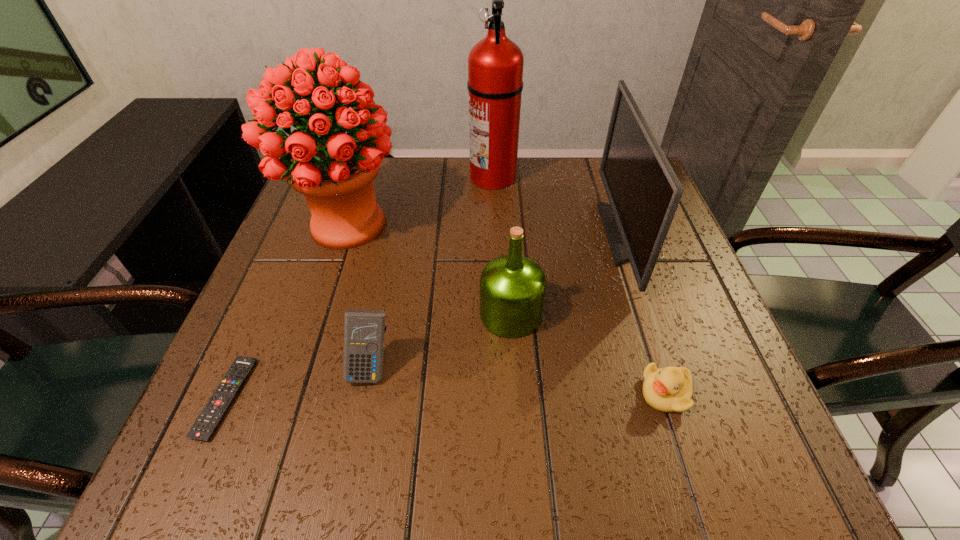
Find the location of a particular element. Image resolution: width=960 pixels, height=540 pixels. vacant space in between the fire extinguisher and the calculator is located at coordinates (432, 272).

At what (x,y) coordinates should I click in order to perform the action: click on free point between the fourth tallest object and the fire extinguisher. Please return your answer as a coordinate pair (x, y). This screenshot has height=540, width=960. Looking at the image, I should click on (502, 245).

Where is `vacant point located between the bouquet and the fire extinguisher`? The height and width of the screenshot is (540, 960). vacant point located between the bouquet and the fire extinguisher is located at coordinates point(420,200).

Identify which object is the second nearest to the monitor. Please provide its 2D coordinates. Your answer should be formatted as a tuple, i.e. [(x, y)], where the tuple contains the x and y coordinates of a point satisfying the conditions above.

[(512, 287)]

You are a GUI agent. You are given a task and a screenshot of the screen. Output one action in this format:
    pyautogui.click(x=<x>, y=<y>)
    Task: Click on the object that is the fifth closest one to the fifth tallest object
    
    Given the screenshot: What is the action you would take?
    point(644,192)

I want to click on free space in the image that satisfies the following two spatial constraints: 1. at the nozzle of the fire extinguisher; 2. on the front-facing side of the calculator, so click(500, 368).

This screenshot has height=540, width=960. I want to click on vacant region that satisfies the following two spatial constraints: 1. on the front-facing side of the second shortest object; 2. on the front side of the remote control, so click(x=666, y=398).

I want to click on free region that satisfies the following two spatial constraints: 1. at the nozzle of the fire extinguisher; 2. on the front-facing side of the calculator, so click(x=500, y=368).

The width and height of the screenshot is (960, 540). Identify the location of free point that satisfies the following two spatial constraints: 1. at the nozzle of the fire extinguisher; 2. on the front-facing side of the fifth tallest object. (500, 368).

Locate an element on the screen. This screenshot has height=540, width=960. blank area in the image that satisfies the following two spatial constraints: 1. at the nozzle of the olive oil; 2. on the right side of the fire extinguisher is located at coordinates (498, 314).